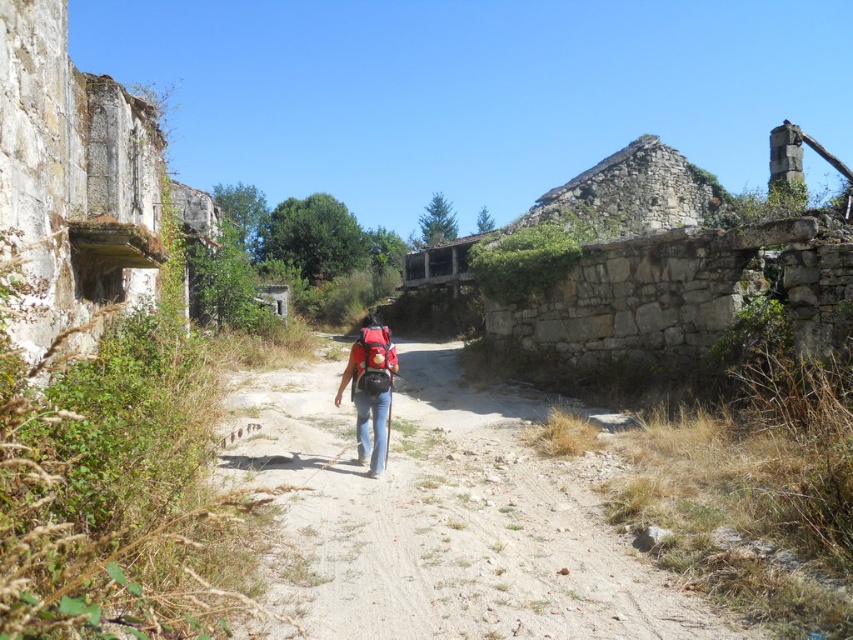
You are hiking along the dusty gravel path at center and see your red backpack at center. Which direction should you walk to reach your backpack?

The dusty gravel path at center is to the right of the red backpack at center, so you should walk to the left to reach your backpack.

You are a hiker who has just arrived at a crossroads in the middle of a rural area. You see a red backpack at center and a matte black backpack at center. Which backpack is positioned closer to the partially ruined stone building on the left side of the path?

The red backpack at center is to the left of the matte black backpack at center. Since the partially ruined stone building is on the left side of the path, the red backpack at center is closer to it.

You are hiking along the dusty gravel path at center and want to place your red backpack at center on the ground. Which direction should you move to so that the backpack is no longer blocking your path?

The dusty gravel path at center is in front of the red backpack at center, so to avoid blocking the path, you should move the red backpack at center to the side or behind it.